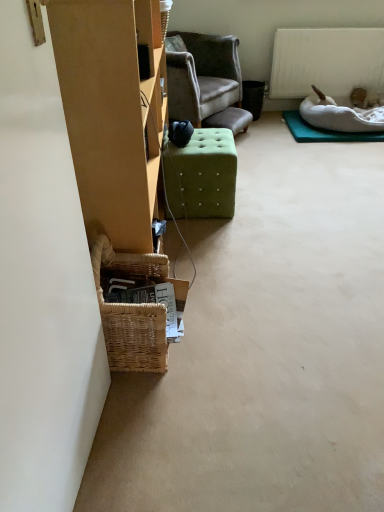
Identify the location of woven brown picnic basket at lower left. (131, 311).

The image size is (384, 512). I want to click on white soft dog bed at upper right, so click(340, 115).

Measure the distance between white matte radiator at upper right and camera.

white matte radiator at upper right and camera are 10.89 feet apart from each other.

Image resolution: width=384 pixels, height=512 pixels. What do you see at coordinates (325, 131) in the screenshot?
I see `white fabric mat at upper right` at bounding box center [325, 131].

At what (x,y) coordinates should I click in order to perform the action: click on woven brown picnic basket at lower left. Please return your answer as a coordinate pair (x, y). This screenshot has width=384, height=512. Looking at the image, I should click on (131, 311).

Does woven brown picnic basket at lower left have a lesser width compared to white soft dog bed at upper right?

Yes, woven brown picnic basket at lower left is thinner than white soft dog bed at upper right.

Is point (150, 347) behind point (348, 108)?

No, (150, 347) is in front of (348, 108).

Is woven brown picnic basket at lower left shorter than white soft dog bed at upper right?

In fact, woven brown picnic basket at lower left may be taller than white soft dog bed at upper right.

I want to click on picnic basket positioned vertically above the white soft dog bed at upper right (from a real-world perspective), so click(131, 311).

Is white matte radiator at upper right oriented towards woven basket at lower left?

Yes, white matte radiator at upper right is turned towards woven basket at lower left.

Based on the photo, how far apart are white matte radiator at upper right and woven basket at lower left?

white matte radiator at upper right and woven basket at lower left are 6.27 feet apart from each other.

From a real-world perspective, between white matte radiator at upper right and woven basket at lower left, who is vertically lower?

woven basket at lower left is physically lower.

Is white matte radiator at upper right in front of or behind woven basket at lower left in the image?

In the image, white matte radiator at upper right appears behind woven basket at lower left.

Visually, is woven basket at lower left positioned to the left or to the right of woven wicker basket at lower left?

Based on their positions, woven basket at lower left is located to the right of woven wicker basket at lower left.

Considering the relative sizes of woven basket at lower left and woven wicker basket at lower left in the image provided, is woven basket at lower left taller than woven wicker basket at lower left?

In fact, woven basket at lower left may be shorter than woven wicker basket at lower left.

Is woven basket at lower left oriented away from woven wicker basket at lower left?

No.

Is the surface of white fabric mat at upper right in direct contact with green fabric ottoman at center?

No, white fabric mat at upper right is not making contact with green fabric ottoman at center.

The image size is (384, 512). What are the coordinates of `stool that is above the white fabric mat at upper right (from a real-world perspective)` in the screenshot? It's located at (202, 175).

Is white fabric mat at upper right facing towards green fabric ottoman at center?

No, white fabric mat at upper right does not turn towards green fabric ottoman at center.

In the image, is white fabric mat at upper right positioned in front of or behind green fabric ottoman at center?

Clearly, white fabric mat at upper right is behind green fabric ottoman at center.

Identify the location of concrete below the white soft dog bed at upper right (from a real-world perspective). (265, 349).

Which of these two, white soft dog bed at upper right or woven basket at lower left, is wider?

woven basket at lower left is wider.

From a real-world perspective, does white soft dog bed at upper right sit lower than woven basket at lower left?

Actually, white soft dog bed at upper right is physically above woven basket at lower left in the real world.

Between white soft dog bed at upper right and woven basket at lower left, which one appears on the left side from the viewer's perspective?

From the viewer's perspective, woven basket at lower left appears more on the left side.

Considering the sizes of objects white fabric mat at upper right and woven basket at lower left in the image provided, who is wider, white fabric mat at upper right or woven basket at lower left?

woven basket at lower left is wider.

Measure the distance from white fabric mat at upper right to woven basket at lower left.

A distance of 1.48 meters exists between white fabric mat at upper right and woven basket at lower left.

Where is `concrete on the left side of white fabric mat at upper right`? concrete on the left side of white fabric mat at upper right is located at coordinates (265, 349).

Is white fabric mat at upper right outside of woven basket at lower left?

No, white fabric mat at upper right is not outside of woven basket at lower left.

From the image's perspective, which is above, white matte radiator at upper right or woven wicker basket at lower left?

From the image's view, white matte radiator at upper right is above.

Is white matte radiator at upper right located outside woven wicker basket at lower left?

white matte radiator at upper right is positioned outside woven wicker basket at lower left.

Between white matte radiator at upper right and woven wicker basket at lower left, which one is positioned behind?

white matte radiator at upper right is further from the camera.

Is white matte radiator at upper right to the left or to the right of woven wicker basket at lower left in the image?

white matte radiator at upper right is to the right of woven wicker basket at lower left.

There is a white soft dog bed at upper right. Identify the location of picnic basket above it (from a real-world perspective). The height and width of the screenshot is (512, 384). (131, 311).

The image size is (384, 512). I want to click on concrete beneath the white matte radiator at upper right (from a real-world perspective), so click(265, 349).

Based on the photo, looking at the image, which one is located further to white fabric mat at upper right, woven wicker basket at lower left or white matte radiator at upper right?

Based on the image, woven wicker basket at lower left appears to be further to white fabric mat at upper right.

Looking at the image, which one is located closer to woven brown picnic basket at lower left, white matte radiator at upper right or woven wicker basket at lower left?

The object closer to woven brown picnic basket at lower left is woven wicker basket at lower left.

When comparing their distances from white soft dog bed at upper right, does white matte radiator at upper right or woven wicker basket at lower left seem closer?

white matte radiator at upper right is positioned closer to the anchor white soft dog bed at upper right.

Based on their spatial positions, is white soft dog bed at upper right or white fabric mat at upper right further from green fabric ottoman at center?

Based on the image, white soft dog bed at upper right appears to be further to green fabric ottoman at center.

Based on their spatial positions, is woven basket at lower left or white matte radiator at upper right further from green fabric ottoman at center?

white matte radiator at upper right is further to green fabric ottoman at center.

Based on their spatial positions, is white soft dog bed at upper right or woven basket at lower left closer to woven wicker basket at lower left?

woven basket at lower left is closer to woven wicker basket at lower left.

Based on their spatial positions, is white soft dog bed at upper right or woven wicker basket at lower left closer to woven brown picnic basket at lower left?

woven wicker basket at lower left lies closer to woven brown picnic basket at lower left than the other object.

Estimate the real-world distances between objects in this image. Which object is closer to woven brown picnic basket at lower left, woven basket at lower left or woven wicker basket at lower left?

Based on the image, woven wicker basket at lower left appears to be nearer to woven brown picnic basket at lower left.

You are a GUI agent. You are given a task and a screenshot of the screen. Output one action in this format:
    pyautogui.click(x=<x>, y=<y>)
    Task: Click on the stool positioned between woven wicker basket at lower left and white soft dog bed at upper right from near to far
    The height and width of the screenshot is (512, 384).
    Given the screenshot: What is the action you would take?
    pyautogui.click(x=202, y=175)

Locate an element on the screen. This screenshot has width=384, height=512. stool between woven brown picnic basket at lower left and white matte radiator at upper right in the front-back direction is located at coordinates (202, 175).

Find the location of a particular element. The width and height of the screenshot is (384, 512). picnic basket positioned between woven basket at lower left and white soft dog bed at upper right from near to far is located at coordinates (131, 311).

You are a GUI agent. You are given a task and a screenshot of the screen. Output one action in this format:
    pyautogui.click(x=<x>, y=<y>)
    Task: Click on the stool between woven brown picnic basket at lower left and white fabric mat at upper right from front to back
    
    Given the screenshot: What is the action you would take?
    pyautogui.click(x=202, y=175)